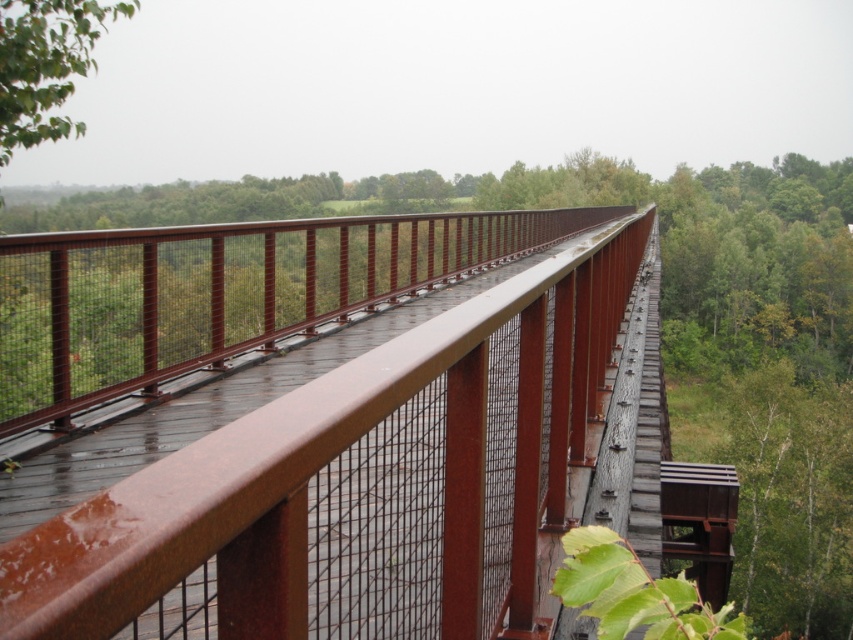
You are an architect evaluating the structural integrity of the rusty metal bridge at center and the green matte tree at upper left. Which object appears smaller in the image?

The rusty metal bridge at center appears smaller than the green matte tree at upper left in the image.

You are standing on the wooden walkway and see two points marked in the image. Which point is nearer to you, point (x=509, y=612) or point (x=18, y=60)?

Point (x=509, y=612) is closer to the viewer than point (x=18, y=60).

You are a hiker carrying a large backpack and need to cross the rusty metal bridge at center. Considering the bridge is narrower than the green matte tree at upper left, will you be able to walk across it safely?

The rusty metal bridge at center has a lesser width compared to green matte tree at upper left. Since the bridge is narrower, you should proceed with caution but it is still possible to walk across safely as long as you maintain balance and avoid the edges.